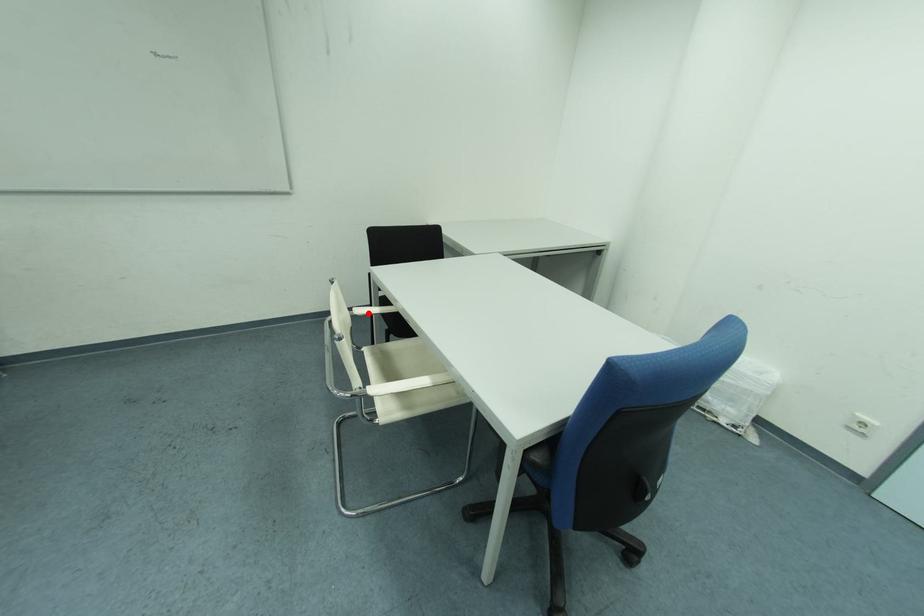
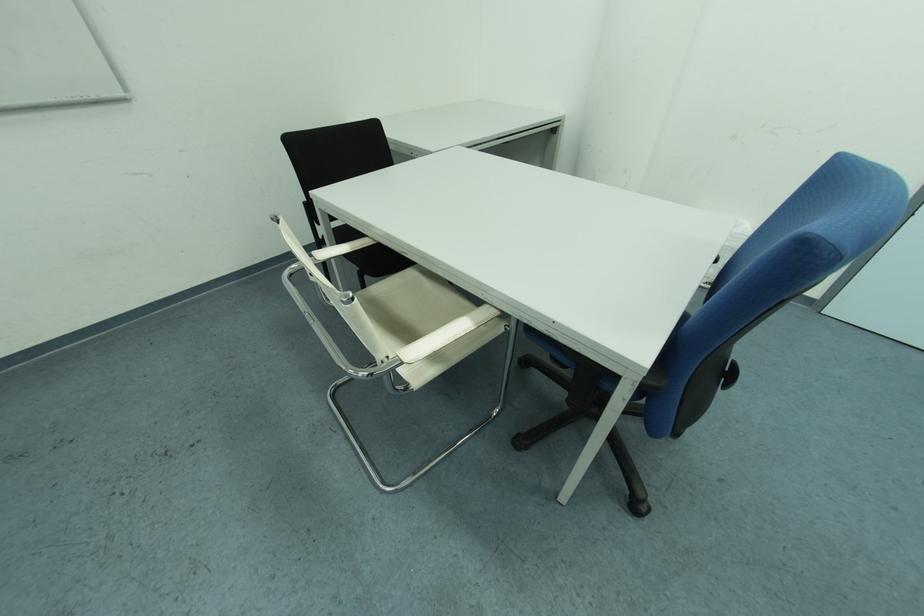
In the second image, find the point that corresponds to the highlighted location in the first image.

(331, 257)